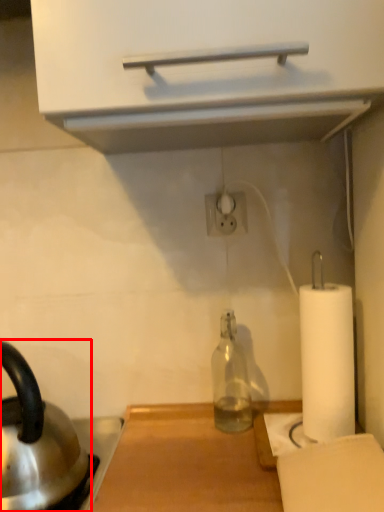
Question: From the image's perspective, what is the correct spatial relationship of kettle (annotated by the red box) in relation to bottle?

Choices:
 (A) below
 (B) above

Answer: (A)